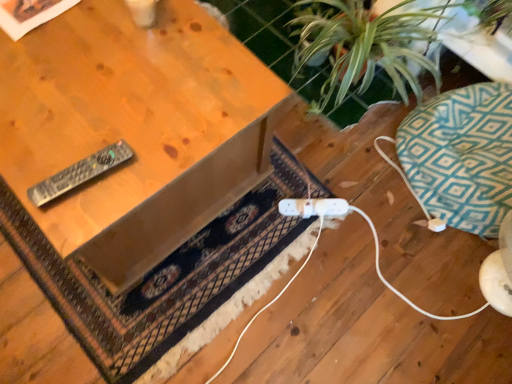
You are a GUI agent. You are given a task and a screenshot of the screen. Output one action in this format:
    pyautogui.click(x=<x>, y=<y>)
    Task: Click on the free point to the right of black plastic remote at left
    
    Given the screenshot: What is the action you would take?
    pyautogui.click(x=146, y=165)